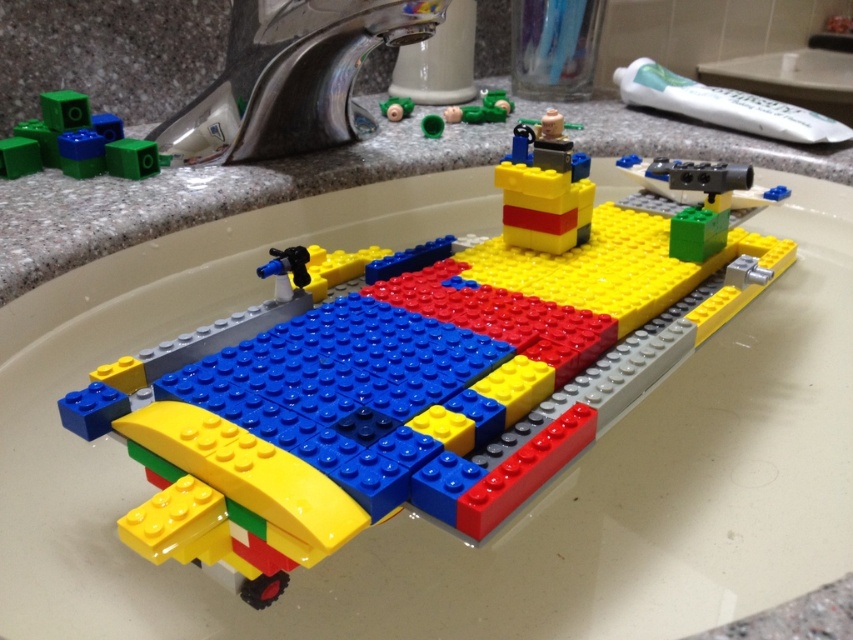
Describe the element at coordinates (399, 387) in the screenshot. I see `yellow matte lego plane at center` at that location.

Where is `yellow matte lego plane at center`? This screenshot has height=640, width=853. yellow matte lego plane at center is located at coordinates (399, 387).

At what (x,y) coordinates should I click in order to perform the action: click on yellow matte lego plane at center. Please return your answer as a coordinate pair (x, y). Image resolution: width=853 pixels, height=640 pixels. Looking at the image, I should click on (399, 387).

Does green matte toy at upper center have a greater height compared to matte green plastic toy at upper center?

Indeed, green matte toy at upper center has a greater height compared to matte green plastic toy at upper center.

Is green matte toy at upper center below matte green plastic toy at upper center?

Actually, green matte toy at upper center is above matte green plastic toy at upper center.

Is point (480, 120) less distant than point (395, 118)?

That is False.

You are a GUI agent. You are given a task and a screenshot of the screen. Output one action in this format:
    pyautogui.click(x=<x>, y=<y>)
    Task: Click on the green matte toy at upper center
    This screenshot has width=853, height=640.
    Given the screenshot: What is the action you would take?
    click(480, 108)

Which is behind, point (149, 145) or point (485, 90)?

Positioned behind is point (485, 90).

Which is below, green matte cube at upper left or green matte toy at upper center?

Positioned lower is green matte cube at upper left.

Is point (62, 138) closer to camera compared to point (479, 122)?

Yes, point (62, 138) is in front of point (479, 122).

This screenshot has width=853, height=640. In order to click on green matte cube at upper left in this screenshot , I will do `click(74, 141)`.